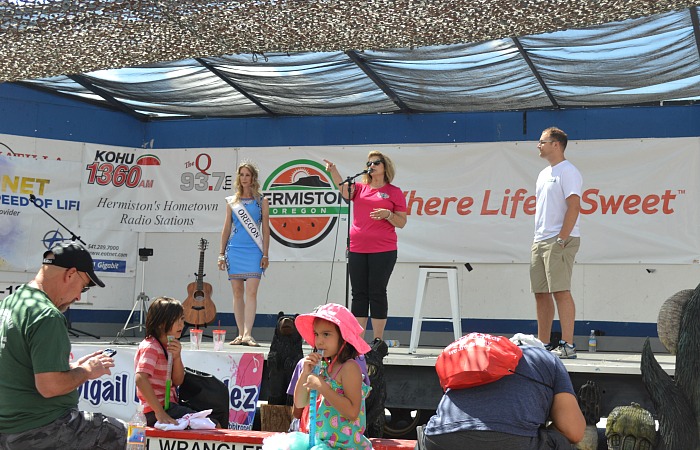
Image resolution: width=700 pixels, height=450 pixels. I want to click on back wall stage event banner, so click(x=433, y=176).